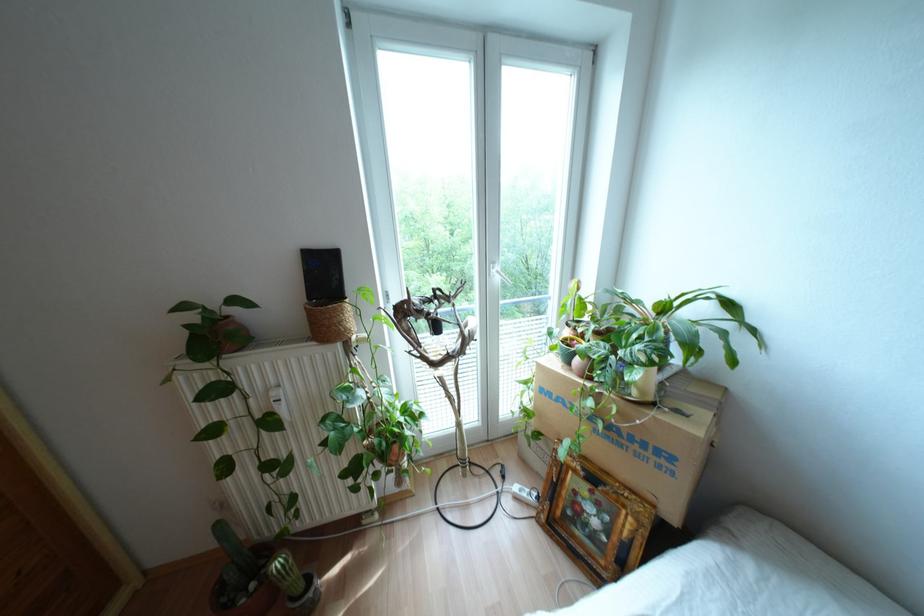
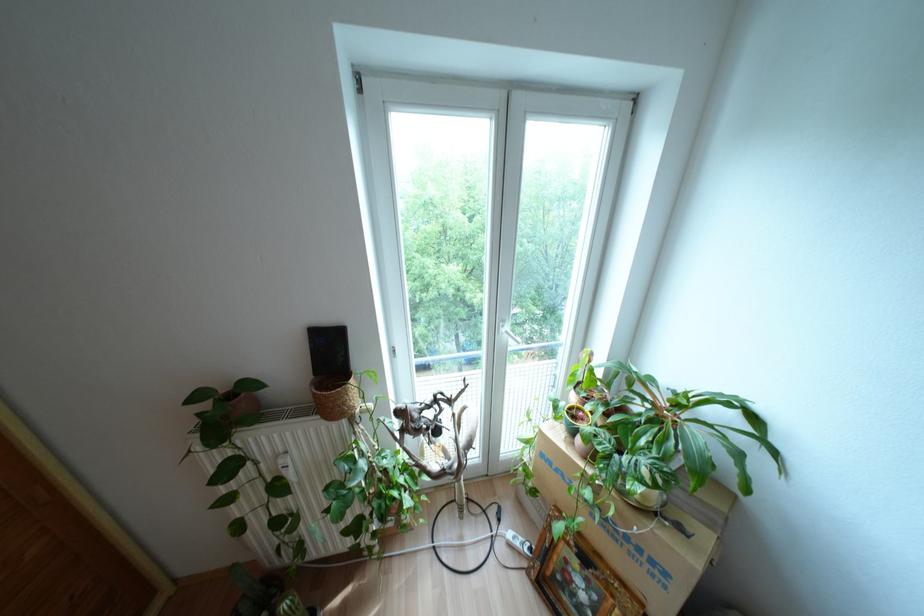
What movement of the cameraman would produce the second image?

The cameraman moved toward right, forward.